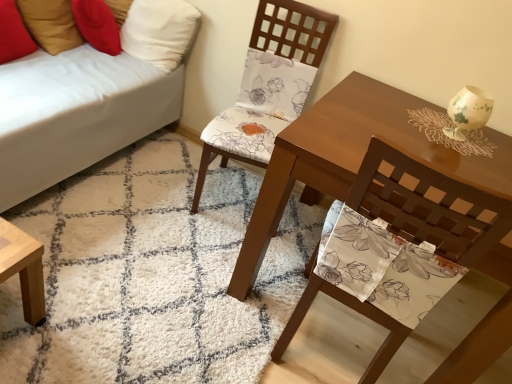
Question: Does floral fabric chair at center, positioned as the first chair in front-to-back order, have a lesser width compared to white fabric couch at lower left?

Choices:
 (A) yes
 (B) no

Answer: (A)

Question: Does floral fabric chair at center, the 2th chair from the back, have a lesser height compared to white fabric couch at lower left?

Choices:
 (A) no
 (B) yes

Answer: (A)

Question: Is there a large distance between floral fabric chair at center, the 2th chair from the back, and white fabric couch at lower left?

Choices:
 (A) yes
 (B) no

Answer: (A)

Question: Could you tell me if floral fabric chair at center, the 2th chair from the back, is turned towards white fabric couch at lower left?

Choices:
 (A) yes
 (B) no

Answer: (B)

Question: Considering the relative positions of floral fabric chair at center, positioned as the first chair in front-to-back order, and white fabric couch at lower left in the image provided, is floral fabric chair at center, positioned as the first chair in front-to-back order, to the right of white fabric couch at lower left from the viewer's perspective?

Choices:
 (A) no
 (B) yes

Answer: (B)

Question: Is white fabric couch at lower left inside floral fabric chair at center, positioned as the first chair in front-to-back order?

Choices:
 (A) yes
 (B) no

Answer: (B)

Question: Is white fabric pillow at upper left, which appears as the 2th pillow when viewed from the left, facing away from matte brown table at center?

Choices:
 (A) no
 (B) yes

Answer: (A)

Question: Would you consider white fabric pillow at upper left, which appears as the 2th pillow when viewed from the left, to be distant from matte brown table at center?

Choices:
 (A) yes
 (B) no

Answer: (A)

Question: Does white fabric pillow at upper left, which is the first pillow in right-to-left order, have a lesser width compared to matte brown table at center?

Choices:
 (A) no
 (B) yes

Answer: (B)

Question: Is matte brown table at center inside white fabric pillow at upper left, which appears as the 2th pillow when viewed from the left?

Choices:
 (A) no
 (B) yes

Answer: (A)

Question: Considering the relative positions of white fabric pillow at upper left, which is the first pillow in right-to-left order, and matte brown table at center in the image provided, is white fabric pillow at upper left, which is the first pillow in right-to-left order, to the left of matte brown table at center from the viewer's perspective?

Choices:
 (A) yes
 (B) no

Answer: (A)

Question: From the image's perspective, would you say white fabric pillow at upper left, which is the first pillow in right-to-left order, is shown under matte brown table at center?

Choices:
 (A) yes
 (B) no

Answer: (B)

Question: Is white fabric couch at lower left turned away from red fabric pillow at upper left, the 1th pillow when ordered from left to right?

Choices:
 (A) yes
 (B) no

Answer: (A)